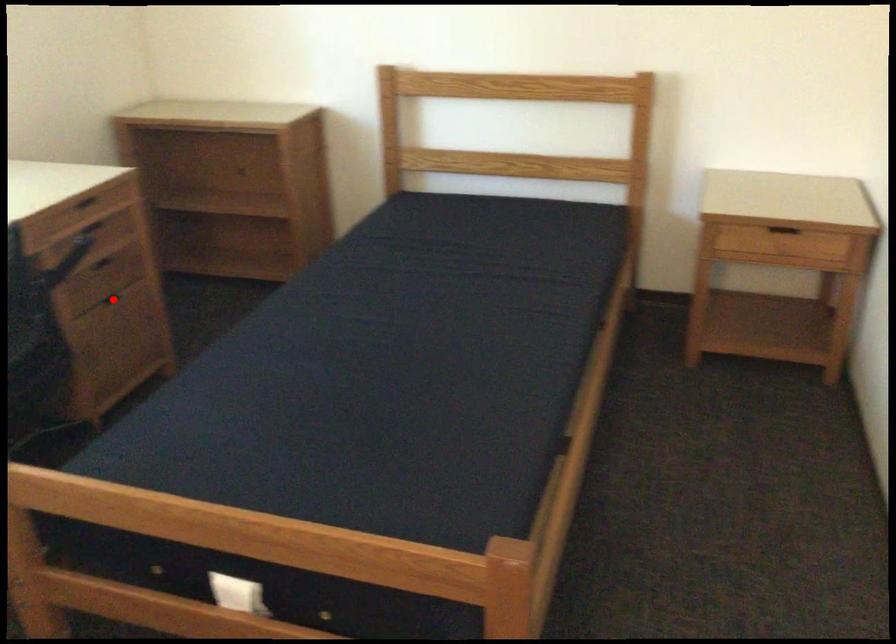
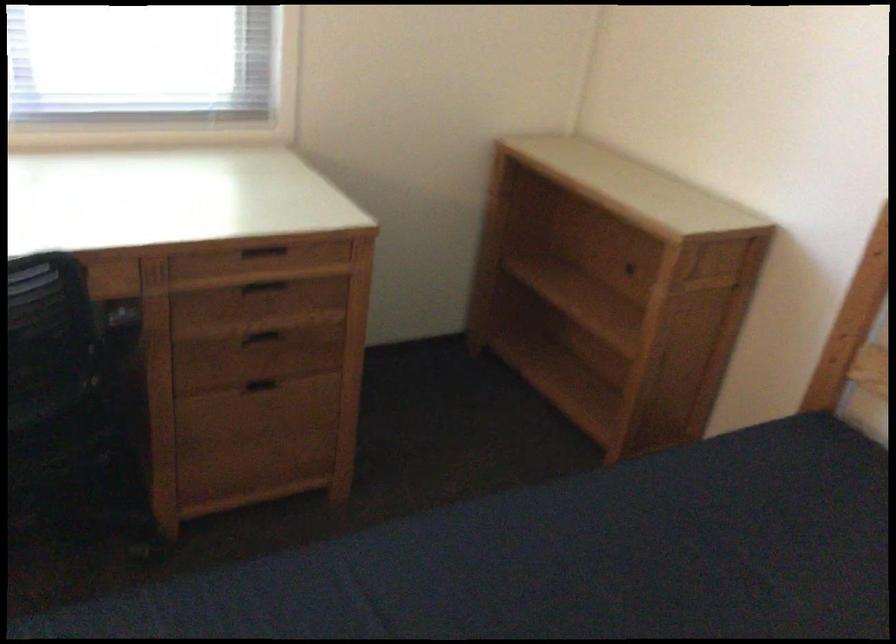
Question: A red point is marked in image1. In image2, is the corresponding 3D point closer to the camera or farther? Reply with the corresponding letter.

Choices:
 (A) The corresponding 3D point is closer.
 (B) The corresponding 3D point is farther.

Answer: (A)